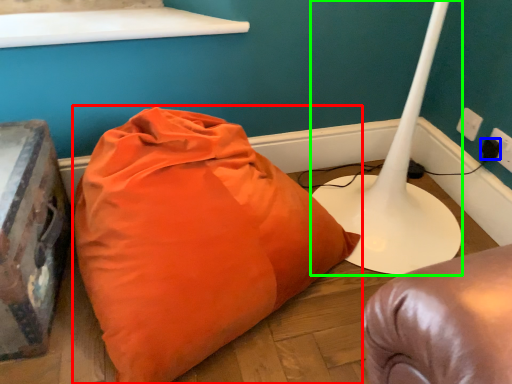
Question: Which object is the farthest from pillow (highlighted by a red box)? Choose among these: plug (highlighted by a blue box) or table lamp (highlighted by a green box).

Choices:
 (A) plug
 (B) table lamp

Answer: (A)